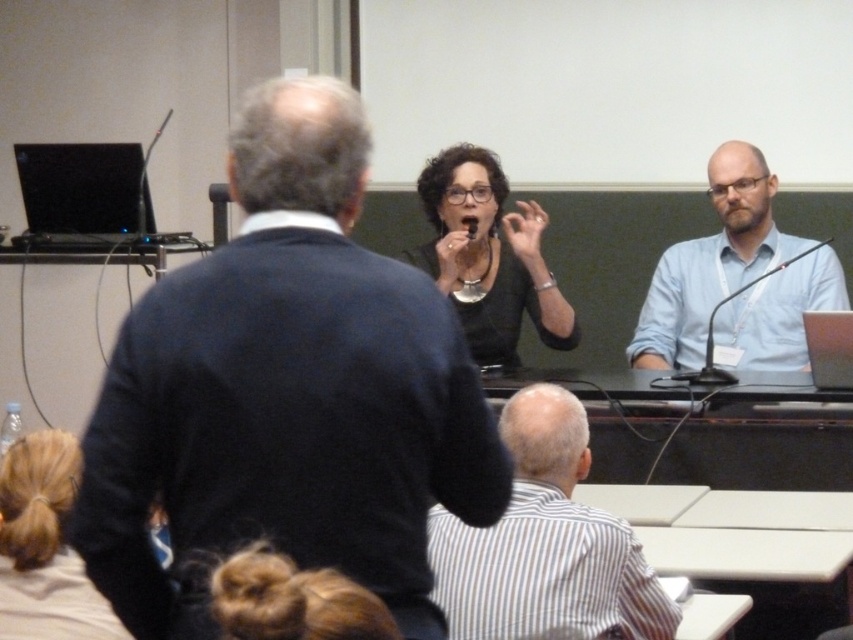
Question: Which point appears closest to the camera in this image?

Choices:
 (A) (61, 436)
 (B) (462, 170)
 (C) (142, 540)

Answer: (C)

Question: Which object is positioned farthest from the blonde hair bun at lower center?

Choices:
 (A) white striped shirt at lower center
 (B) matte black shirt at center
 (C) dark blue sweater at center

Answer: (B)

Question: Where is white striped shirt at lower center located in relation to matte black shirt at center in the image?

Choices:
 (A) right
 (B) left

Answer: (A)

Question: Which point is farther from the camera taking this photo?

Choices:
 (A) (3, 600)
 (B) (502, 188)

Answer: (B)

Question: Where is dark blue sweater at center located in relation to blonde hair bun at lower left in the image?

Choices:
 (A) above
 (B) below

Answer: (A)

Question: Does dark blue sweater at center have a larger size compared to white striped shirt at lower center?

Choices:
 (A) yes
 (B) no

Answer: (A)